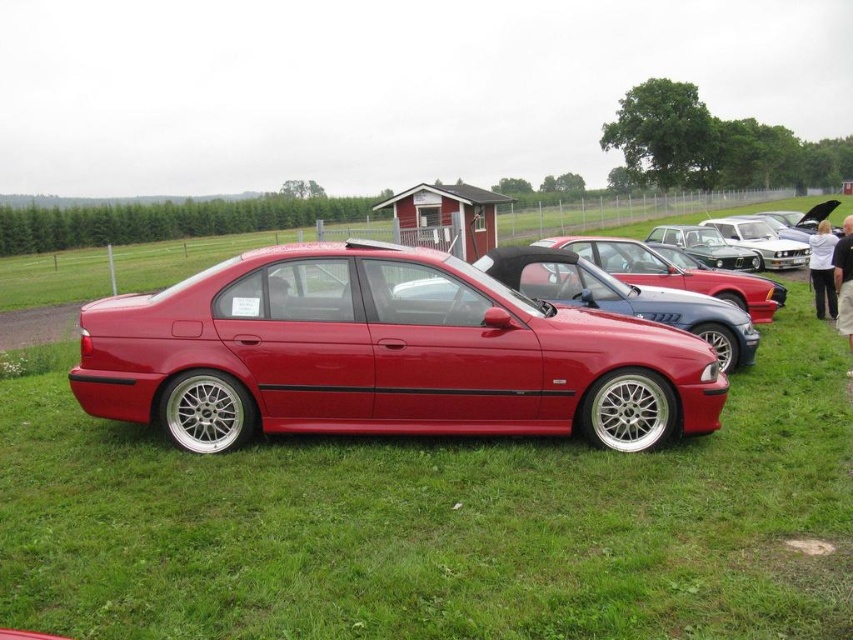
You are a photographer planning to take a photo of the glossy metallic car at center and the metallic silver sedan at center. Since you want to include both cars in the frame, which car should you position closer to the camera to make them appear the same size?

The glossy metallic car at center is shorter than the metallic silver sedan at center. To make them appear the same size in the photo, you should position the glossy metallic car at center closer to the camera than the metallic silver sedan at center.

You are a photographer trying to capture the glossy metallic car at center and the metallic silver sedan at center. According to the scene, which car should you focus on first if you want to photograph them in order from the closest to farthest from your viewpoint?

The glossy metallic car at center is located below the metallic silver sedan at center, so the glossy metallic car at center is closer to you and should be focused on first.